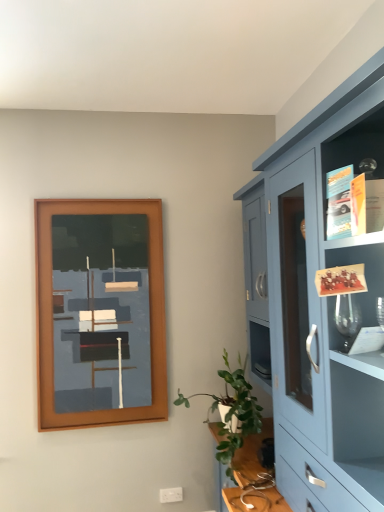
This screenshot has height=512, width=384. Identify the location of brown wooden picture frame at upper left. (100, 312).

How much distance is there between matte blue cabinet at right and green leafy plant at lower right?

78.65 centimeters.

Could you tell me if matte blue cabinet at right is facing green leafy plant at lower right?

Yes, matte blue cabinet at right is aimed at green leafy plant at lower right.

Considering the points (322, 351) and (243, 424), which point is behind, point (322, 351) or point (243, 424)?

Point (243, 424)

Which is more to the right, matte blue cabinet at right or green leafy plant at lower right?

matte blue cabinet at right.

Considering their positions, is brown wooden picture frame at upper left located in front of or behind matte blue cabinet at right?

brown wooden picture frame at upper left is behind matte blue cabinet at right.

Where is `picture frame on the left of matte blue cabinet at right`? picture frame on the left of matte blue cabinet at right is located at coordinates (100, 312).

Considering the relative sizes of brown wooden picture frame at upper left and matte blue cabinet at right in the image provided, is brown wooden picture frame at upper left thinner than matte blue cabinet at right?

Yes.

Can we say brown wooden picture frame at upper left lies outside matte blue cabinet at right?

Indeed, brown wooden picture frame at upper left is completely outside matte blue cabinet at right.

Can we say matte blue cabinet at right lies outside brown wooden picture frame at upper left?

matte blue cabinet at right is positioned outside brown wooden picture frame at upper left.

Considering the sizes of matte blue cabinet at right and brown wooden picture frame at upper left in the image, is matte blue cabinet at right bigger or smaller than brown wooden picture frame at upper left?

Clearly, matte blue cabinet at right is larger in size than brown wooden picture frame at upper left.

How many degrees apart are the facing directions of matte blue cabinet at right and brown wooden picture frame at upper left?

The angular difference between matte blue cabinet at right and brown wooden picture frame at upper left is 90.1 degrees.

Identify the location of cabinetry in front of the brown wooden picture frame at upper left. (326, 296).

Would you say green leafy plant at lower right is to the left or to the right of matte blue cabinet at right in the picture?

From the image, it's evident that green leafy plant at lower right is to the left of matte blue cabinet at right.

Is green leafy plant at lower right smaller than matte blue cabinet at right?

Yes.

Between green leafy plant at lower right and matte blue cabinet at right, which one has smaller width?

green leafy plant at lower right.

From the image's perspective, is green leafy plant at lower right located above matte blue cabinet at right?

No, from the image's perspective, green leafy plant at lower right is not over matte blue cabinet at right.

I want to click on picture frame behind the green leafy plant at lower right, so click(x=100, y=312).

Is brown wooden picture frame at upper left in contact with green leafy plant at lower right?

brown wooden picture frame at upper left is not next to green leafy plant at lower right, and they're not touching.

Considering the relative sizes of brown wooden picture frame at upper left and green leafy plant at lower right in the image provided, is brown wooden picture frame at upper left wider than green leafy plant at lower right?

No, brown wooden picture frame at upper left is not wider than green leafy plant at lower right.

Is green leafy plant at lower right located within brown wooden picture frame at upper left?

No, green leafy plant at lower right is located outside of brown wooden picture frame at upper left.

How distant is green leafy plant at lower right from brown wooden picture frame at upper left?

The distance of green leafy plant at lower right from brown wooden picture frame at upper left is 72.54 centimeters.

Is point (231, 420) closer to camera compared to point (107, 345)?

Yes, it is.

Which object is wider, green leafy plant at lower right or brown wooden picture frame at upper left?

With larger width is green leafy plant at lower right.

How different are the orientations of green leafy plant at lower right and brown wooden picture frame at upper left in degrees?

They differ by 94.3 degrees in their facing directions.

Where is `houseplant below the matte blue cabinet at right (from a real-world perspective)`? This screenshot has height=512, width=384. houseplant below the matte blue cabinet at right (from a real-world perspective) is located at coordinates (232, 412).

Image resolution: width=384 pixels, height=512 pixels. I want to click on picture frame located above the matte blue cabinet at right (from a real-world perspective), so click(100, 312).

Estimate the real-world distances between objects in this image. Which object is further from green leafy plant at lower right, matte blue cabinet at right or brown wooden picture frame at upper left?

matte blue cabinet at right is further to green leafy plant at lower right.

Which object lies nearer to the anchor point matte blue cabinet at right, green leafy plant at lower right or brown wooden picture frame at upper left?

Based on the image, green leafy plant at lower right appears to be nearer to matte blue cabinet at right.

Which object lies further to the anchor point brown wooden picture frame at upper left, matte blue cabinet at right or green leafy plant at lower right?

matte blue cabinet at right.

When comparing their distances from green leafy plant at lower right, does brown wooden picture frame at upper left or matte blue cabinet at right seem further?

matte blue cabinet at right lies further to green leafy plant at lower right than the other object.

When comparing their distances from brown wooden picture frame at upper left, does green leafy plant at lower right or matte blue cabinet at right seem further?

matte blue cabinet at right is positioned further to the anchor brown wooden picture frame at upper left.

Which object lies nearer to the anchor point matte blue cabinet at right, brown wooden picture frame at upper left or green leafy plant at lower right?

green leafy plant at lower right is closer to matte blue cabinet at right.

The height and width of the screenshot is (512, 384). I want to click on houseplant between matte blue cabinet at right and brown wooden picture frame at upper left along the z-axis, so click(232, 412).